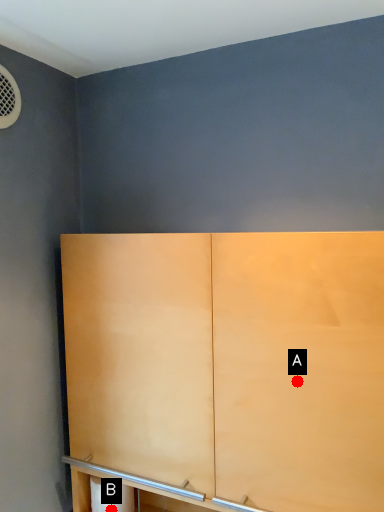
Question: Two points are circled on the image, labeled by A and B beside each circle. Which point is farther from the camera taking this photo?

Choices:
 (A) A is further
 (B) B is further

Answer: (B)